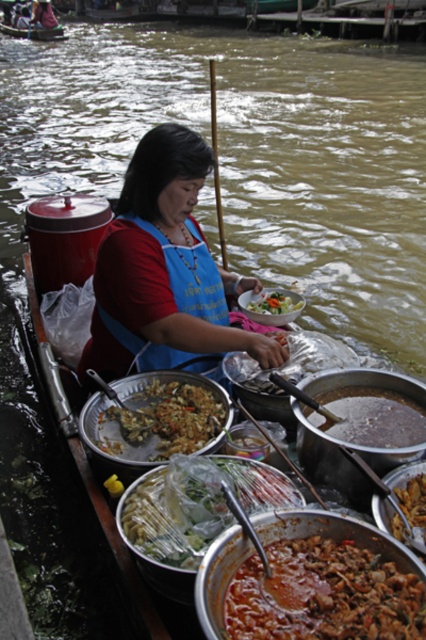
Question: Does brown matte fried rice at center appear over brown matte pot at center?

Choices:
 (A) yes
 (B) no

Answer: (B)

Question: Estimate the real-world distances between objects in this image. Which object is closer to the wooden boat at center?

Choices:
 (A) saucy brown meat at center
 (B) translucent plastic bag at center
 (C) shiny plastic bowl at center

Answer: (C)

Question: Which point is closer to the camera taking this photo?

Choices:
 (A) (210, 410)
 (B) (264, 304)

Answer: (A)

Question: Which is nearer to the shiny silver tongs at center?

Choices:
 (A) translucent plastic bag at center
 (B) brown matte fried rice at center
 (C) blue fabric apron at center

Answer: (A)

Question: Does saucy brown meat at center lie behind brown matte pot at center?

Choices:
 (A) yes
 (B) no

Answer: (B)

Question: Does blue fabric apron at center appear over saucy brown meat at center?

Choices:
 (A) yes
 (B) no

Answer: (A)